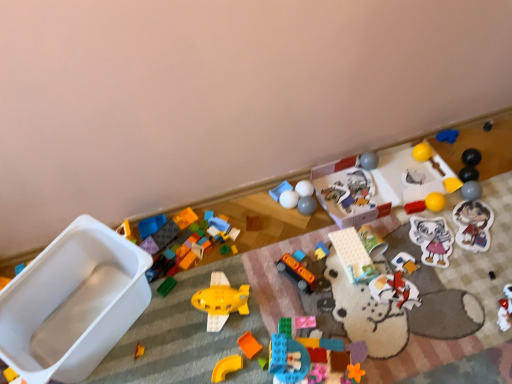
Identify the location of empty space that is in between white glossy sticker at center-right, which is counted as the sixth toy, starting from the right, and translucent plastic blocks at center, positioned as the 15th toy in right-to-left order. (379, 302).